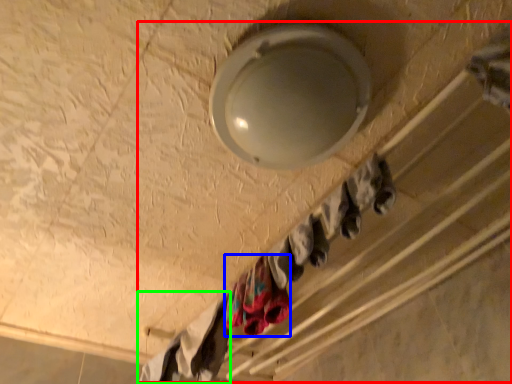
Question: Considering the real-world distances, which object is farthest from closet (highlighted by a red box)? clothing (highlighted by a blue box) or clothing (highlighted by a green box)?

Choices:
 (A) clothing
 (B) clothing

Answer: (A)